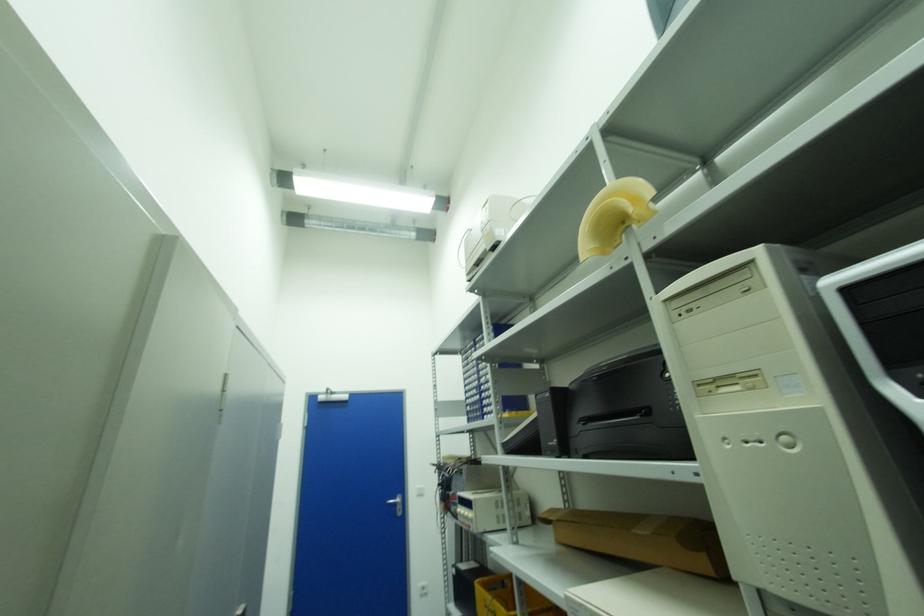
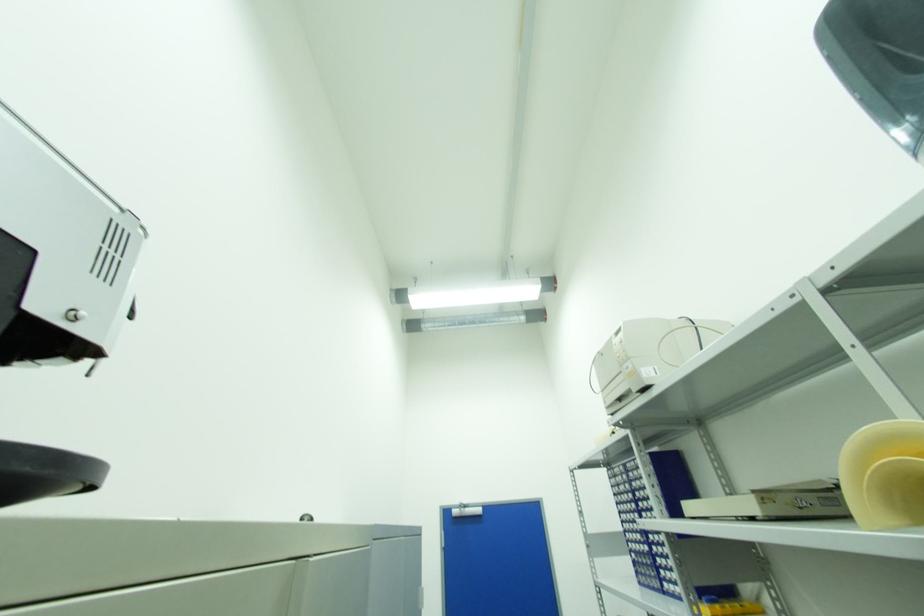
Question: The images are taken continuously from a first-person perspective. In which direction is your viewpoint rotating?

Choices:
 (A) Left
 (B) Right
 (C) Up
 (D) Down

Answer: (A)